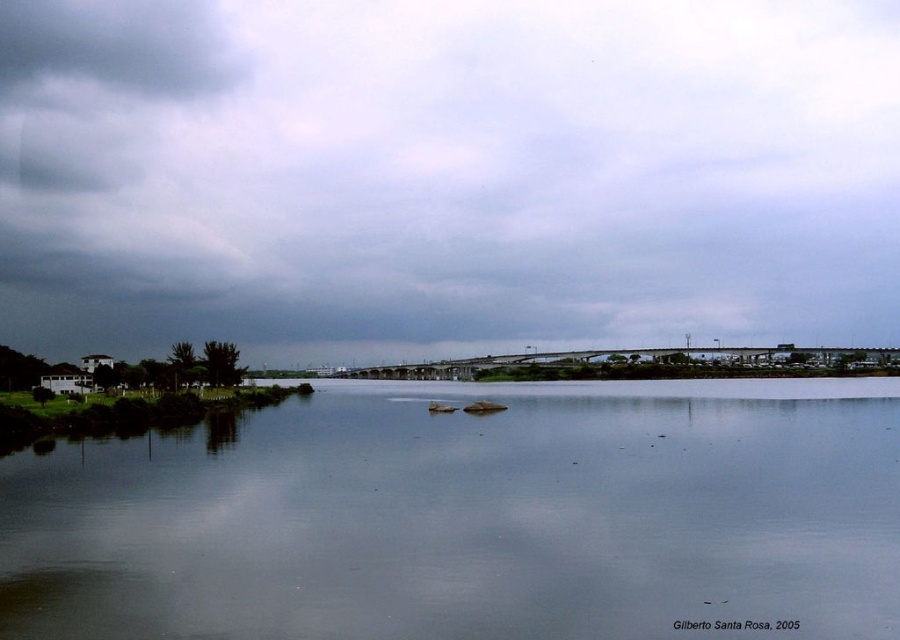
Does smooth water at center have a greater height compared to dark gray cloud at upper left?

No.

Based on the photo, can you confirm if smooth water at center is positioned below dark gray cloud at upper left?

Correct, smooth water at center is located below dark gray cloud at upper left.

Is point (777, 577) closer to camera compared to point (6, 93)?

Yes, point (777, 577) is in front of point (6, 93).

Identify the location of smooth water at center. (471, 516).

Can you confirm if cloudy sky at upper center is bigger than dark gray cloud at upper left?

Correct, cloudy sky at upper center is larger in size than dark gray cloud at upper left.

Who is more distant from viewer, [297,97] or [74,76]?

The point [74,76] is behind.

The image size is (900, 640). What are the coordinates of `cloudy sky at upper center` in the screenshot? It's located at (446, 173).

Does cloudy sky at upper center have a lesser width compared to smooth water at center?

No.

Where is `cloudy sky at upper center`? This screenshot has width=900, height=640. cloudy sky at upper center is located at coordinates (446, 173).

Locate an element on the screen. The image size is (900, 640). cloudy sky at upper center is located at coordinates (446, 173).